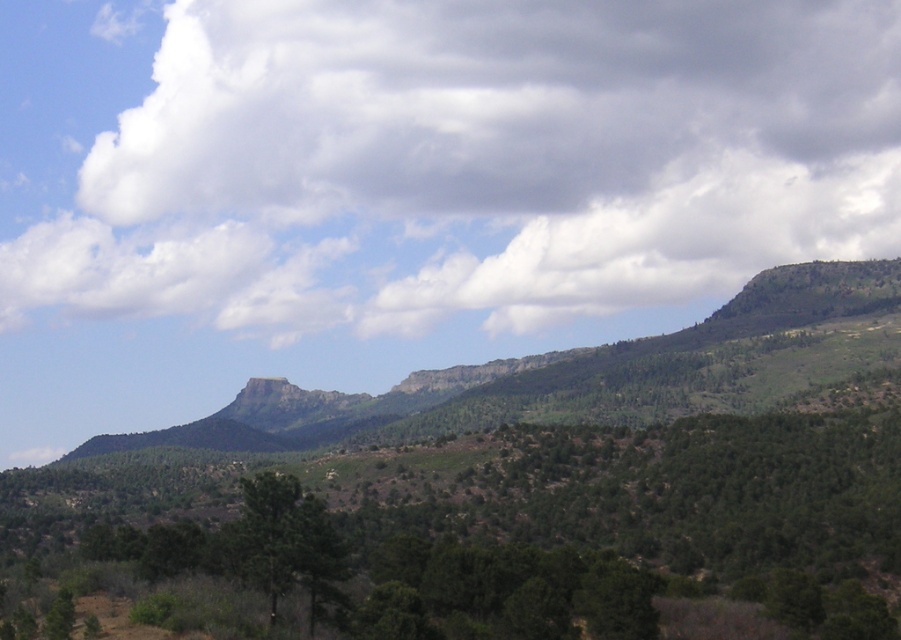
Is white fluffy cloud at upper center further to camera compared to green matte tree at center?

That is True.

I want to click on white fluffy cloud at upper center, so click(x=494, y=106).

The height and width of the screenshot is (640, 901). In order to click on white fluffy cloud at upper center in this screenshot , I will do `click(494, 106)`.

Who is higher up, green textured hillside at center or green matte tree at center?

Positioned higher is green matte tree at center.

Does point (437, 532) lie in front of point (274, 506)?

No, (437, 532) is further to viewer.

The image size is (901, 640). Find the location of `green textured hillside at center`. green textured hillside at center is located at coordinates (520, 486).

Is green textured hillside at center closer to the viewer compared to white fluffy cloud at upper center?

Yes, it is in front of white fluffy cloud at upper center.

Locate an element on the screen. The height and width of the screenshot is (640, 901). green textured hillside at center is located at coordinates (520, 486).

I want to click on green textured hillside at center, so click(520, 486).

What are the coordinates of `green textured hillside at center` in the screenshot? It's located at (520, 486).